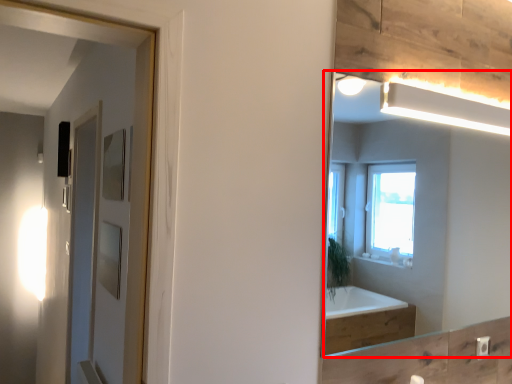
Question: In this image, where is mirror (annotated by the red box) located relative to screen door?

Choices:
 (A) left
 (B) right

Answer: (B)